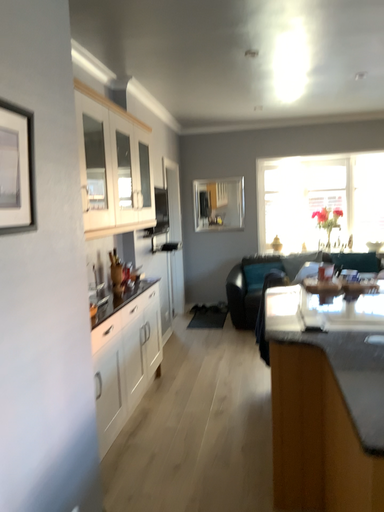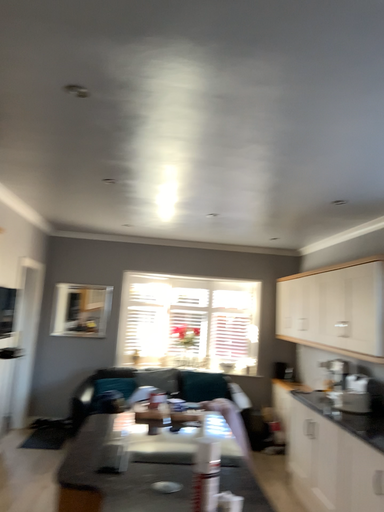
Question: Which way did the camera rotate in the video?

Choices:
 (A) rotated upward
 (B) rotated downward

Answer: (A)